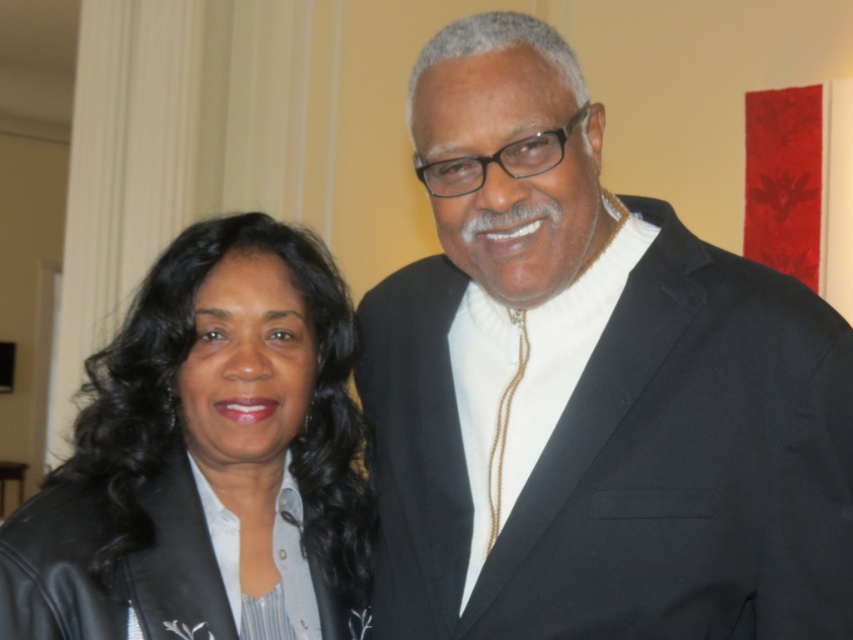
Question: Which point is closer to the camera?

Choices:
 (A) (543, 538)
 (B) (320, 600)
 (C) (160, 262)

Answer: (A)

Question: Can you confirm if leather jacket at left is positioned above black leather jacket at lower left?

Choices:
 (A) no
 (B) yes

Answer: (B)

Question: Which of the following is the farthest from the observer?

Choices:
 (A) leather jacket at left
 (B) black leather jacket at lower left
 (C) black matte suit at center

Answer: (B)

Question: Does black matte suit at center appear under leather jacket at left?

Choices:
 (A) no
 (B) yes

Answer: (A)

Question: Is black matte suit at center thinner than leather jacket at left?

Choices:
 (A) no
 (B) yes

Answer: (A)

Question: Which object is closer to the camera taking this photo?

Choices:
 (A) leather jacket at left
 (B) black leather jacket at lower left

Answer: (A)